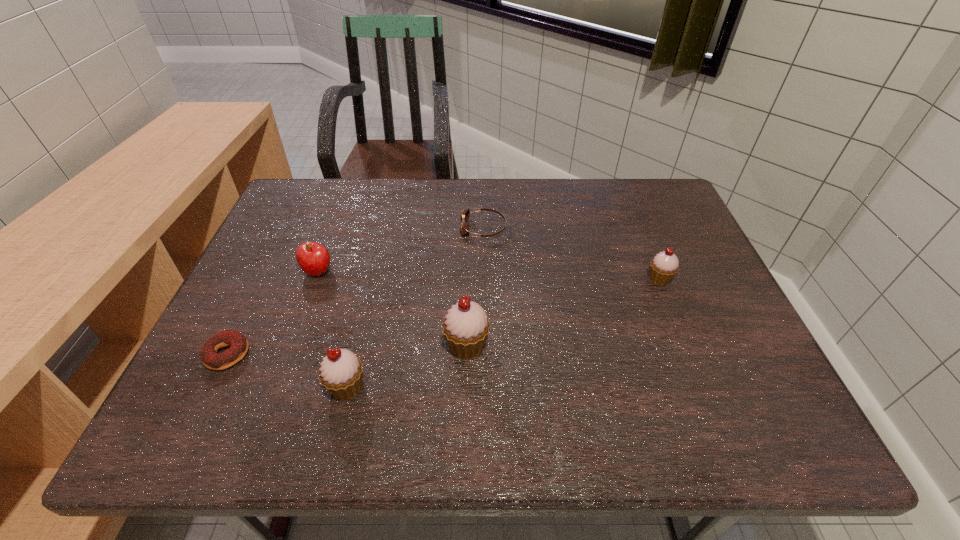
This screenshot has height=540, width=960. I want to click on free area in between the shortest cupcake and the tallest object, so [563, 312].

This screenshot has width=960, height=540. Find the location of `vacant space that is in between the second nearest cupcake and the leftmost cupcake`. vacant space that is in between the second nearest cupcake and the leftmost cupcake is located at coordinates (407, 366).

Locate an element on the screen. The height and width of the screenshot is (540, 960). empty space between the apple and the doughnut is located at coordinates (274, 313).

Where is `free space that is in between the leftmost cupcake and the rightmost cupcake`? This screenshot has width=960, height=540. free space that is in between the leftmost cupcake and the rightmost cupcake is located at coordinates (503, 333).

You are a GUI agent. You are given a task and a screenshot of the screen. Output one action in this format:
    pyautogui.click(x=<x>, y=<y>)
    Task: Click on the vacant space that is in between the farthest cupcake and the goggles
    
    Given the screenshot: What is the action you would take?
    pyautogui.click(x=571, y=253)

Where is `free space that is in between the doughnut and the farthest object`? The height and width of the screenshot is (540, 960). free space that is in between the doughnut and the farthest object is located at coordinates (355, 291).

This screenshot has height=540, width=960. What are the coordinates of `free space between the tallest cupcake and the leftmost cupcake` in the screenshot? It's located at (407, 366).

The image size is (960, 540). I want to click on vacant space in between the rightmost object and the leftmost cupcake, so click(503, 333).

This screenshot has height=540, width=960. In order to click on free space between the doughnut and the shortest cupcake in this screenshot , I will do `click(444, 316)`.

Image resolution: width=960 pixels, height=540 pixels. Find the location of `object that is the closest to the third object from left to right`. object that is the closest to the third object from left to right is located at coordinates 465,328.